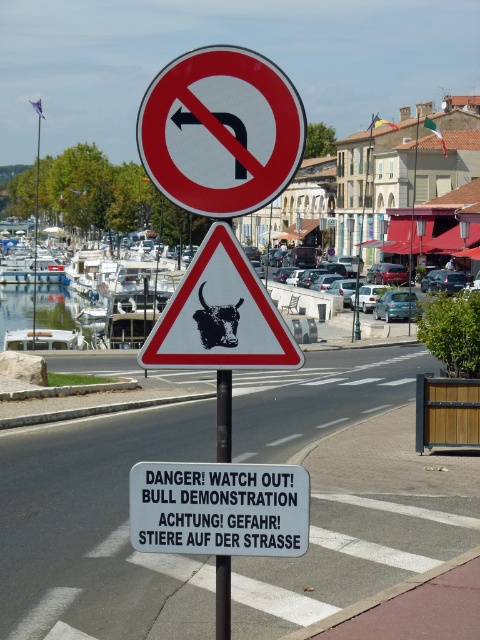
Is white plastic sign at center shorter than white triangular warning sign with black bull at center at upper center?

Correct, white plastic sign at center is not as tall as white triangular warning sign with black bull at center at upper center.

Can you confirm if white plastic sign at center is positioned to the left of white triangular warning sign with black bull at center at upper center?

Incorrect, white plastic sign at center is not on the left side of white triangular warning sign with black bull at center at upper center.

Measure the distance between point (304, 481) and camera.

Point (304, 481) and camera are 3.81 meters apart.

Locate an element on the screen. This screenshot has width=480, height=640. white plastic sign at center is located at coordinates (218, 508).

Is red plastic sign at upper center wider than brushed metal pole at center?

Correct, the width of red plastic sign at upper center exceeds that of brushed metal pole at center.

Who is more distant from viewer, (176,106) or (227,630)?

Point (227,630)

What are the coordinates of `red plastic sign at upper center` in the screenshot? It's located at (220, 131).

Can you confirm if red plastic sign at upper center is wider than white plastic sign at center?

Yes.

Is red plastic sign at upper center to the right of white plastic sign at center from the viewer's perspective?

In fact, red plastic sign at upper center is to the left of white plastic sign at center.

Describe the element at coordinates (220, 131) in the screenshot. I see `red plastic sign at upper center` at that location.

You are a GUI agent. You are given a task and a screenshot of the screen. Output one action in this format:
    pyautogui.click(x=<x>, y=<y>)
    Task: Click on the red plastic sign at upper center
    
    Given the screenshot: What is the action you would take?
    pyautogui.click(x=220, y=131)